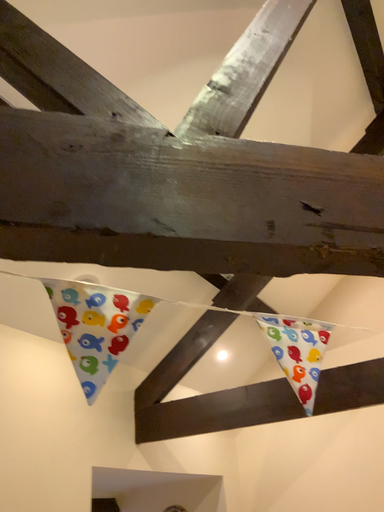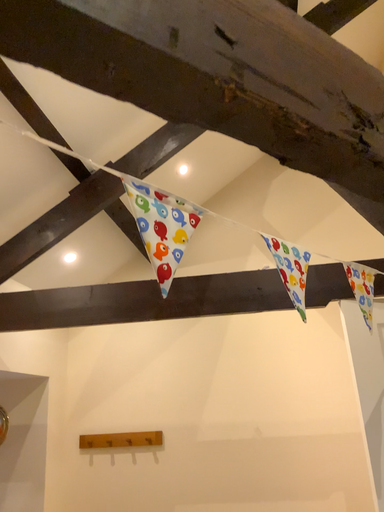
Question: How did the camera likely rotate when shooting the video?

Choices:
 (A) rotated downward
 (B) rotated upward

Answer: (A)